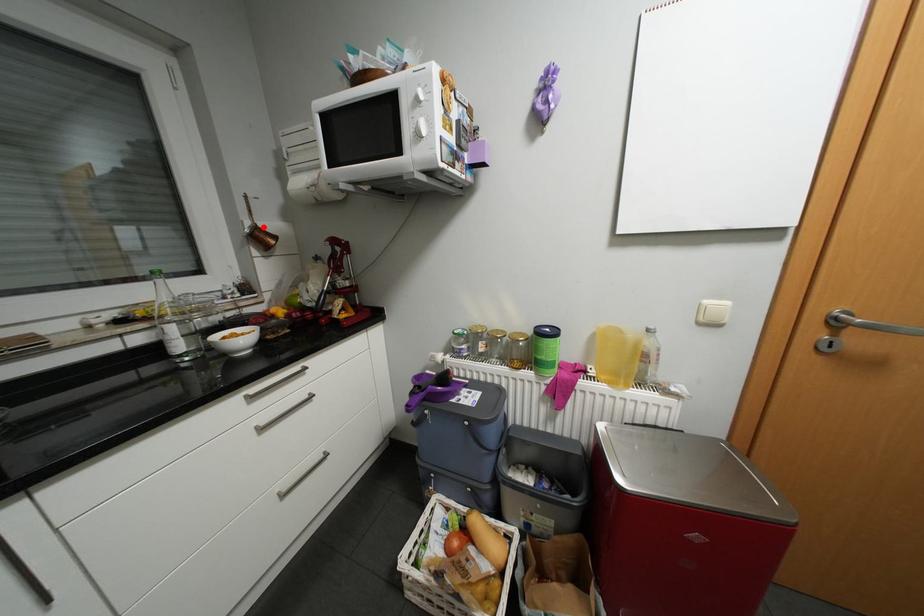
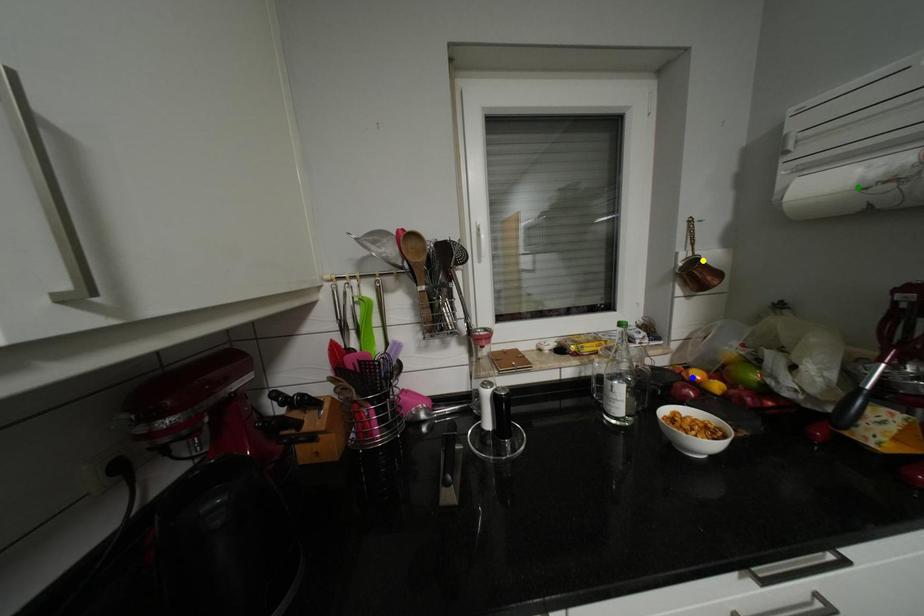
Question: I am providing you with two images of the same scene from different viewpoints. A red point is marked on the first image. You are given multiple points on the second image. Which mark in image 2 goes with the point in image 1?

Choices:
 (A) yellow point
 (B) blue point
 (C) green point

Answer: (A)